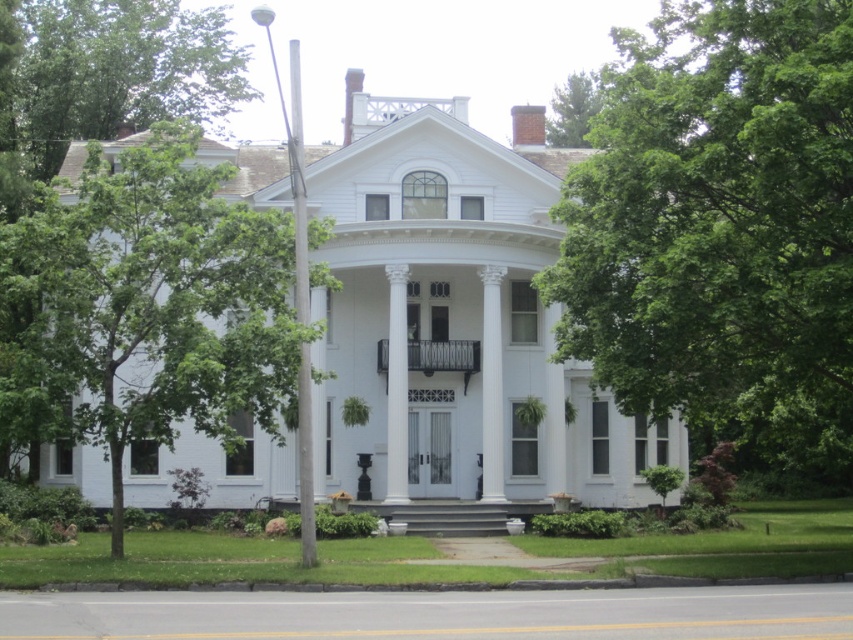
Question: Which point is farther to the camera?

Choices:
 (A) (405, 442)
 (B) (248, 296)
 (C) (550, 296)
 (D) (422, 348)

Answer: (D)

Question: Among these points, which one is farthest from the camera?

Choices:
 (A) (289, 136)
 (B) (445, 348)

Answer: (B)

Question: Does white smooth column at center appear over polished metal railing at center?

Choices:
 (A) yes
 (B) no

Answer: (B)

Question: Which of the following is the closest to the observer?

Choices:
 (A) (201, 51)
 (B) (601, 93)

Answer: (A)

Question: Does green leafy tree at left have a smaller size compared to green leafy tree at upper center?

Choices:
 (A) yes
 (B) no

Answer: (B)

Question: Is green leafy tree at center bigger than green leafy tree at upper center?

Choices:
 (A) yes
 (B) no

Answer: (A)